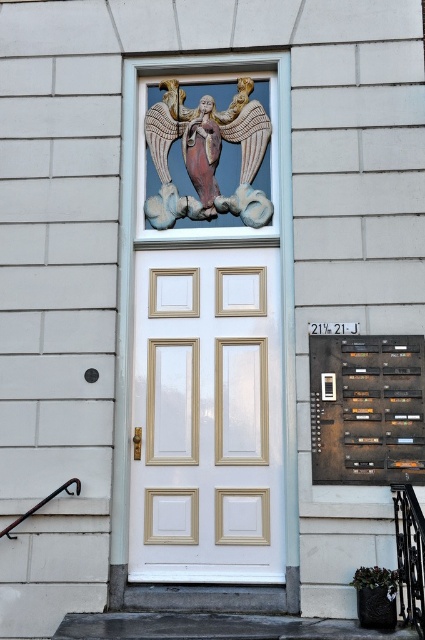
Question: Which object is farther from the camera taking this photo?

Choices:
 (A) white painted wood door at center
 (B) black wrought iron balustrade at lower right
 (C) polychrome stone angel at upper center

Answer: (C)

Question: Which point appears farthest from the camera in this image?

Choices:
 (A) (405, 608)
 (B) (226, 113)
 (C) (374, 419)
 (D) (150, 352)

Answer: (B)

Question: Where is gray concrete stairs at lower center located in relation to black wrought iron balustrade at lower right in the image?

Choices:
 (A) right
 (B) left

Answer: (B)

Question: Does gray concrete stairs at lower center appear on the right side of black wrought iron balustrade at lower right?

Choices:
 (A) no
 (B) yes

Answer: (A)

Question: Considering the real-world distances, which object is closest to the dark brown wooden plaque at lower right?

Choices:
 (A) gray concrete stairs at lower center
 (B) polychrome stone angel at upper center
 (C) black wrought iron balustrade at lower right

Answer: (C)

Question: Is white painted wood door at center above polychrome stone angel at upper center?

Choices:
 (A) no
 (B) yes

Answer: (A)